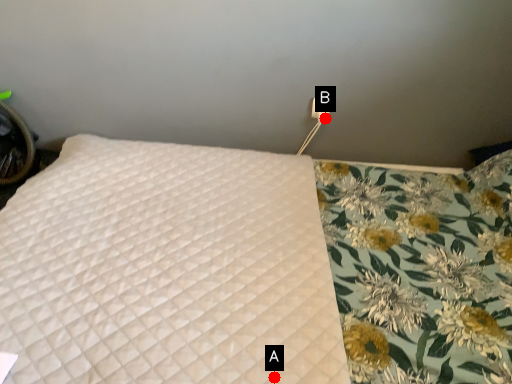
Question: Two points are circled on the image, labeled by A and B beside each circle. Which point is closer to the camera?

Choices:
 (A) A is closer
 (B) B is closer

Answer: (A)